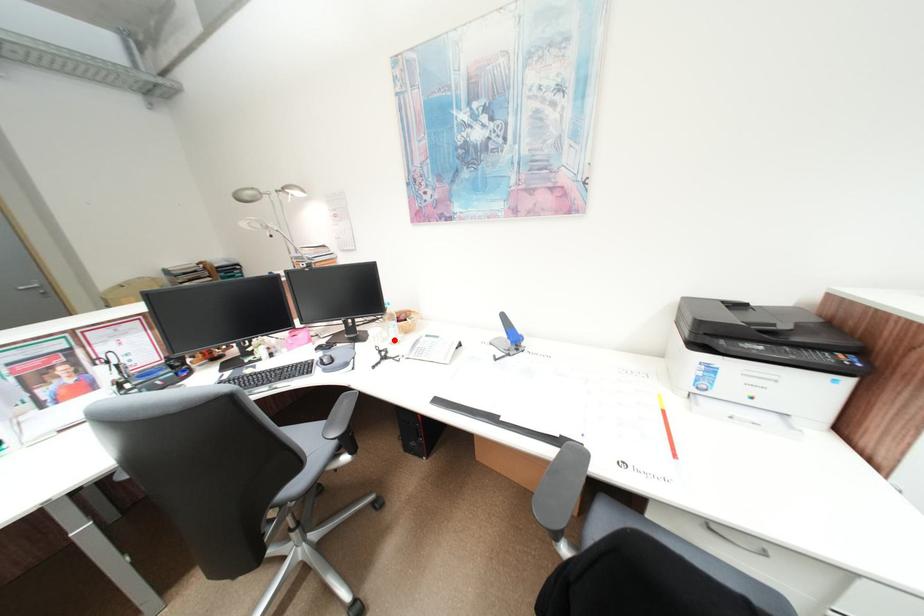
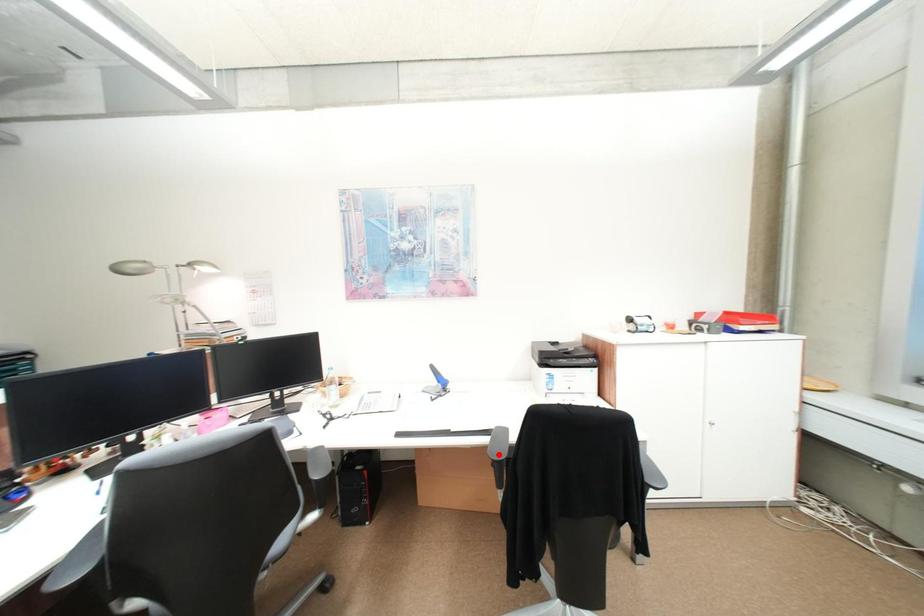
I am providing you with two images of the same scene from different viewpoints. A red point is marked on the first image and another point is marked on the second image. Does the point marked in image1 correspond to the same location as the one in image2?

No